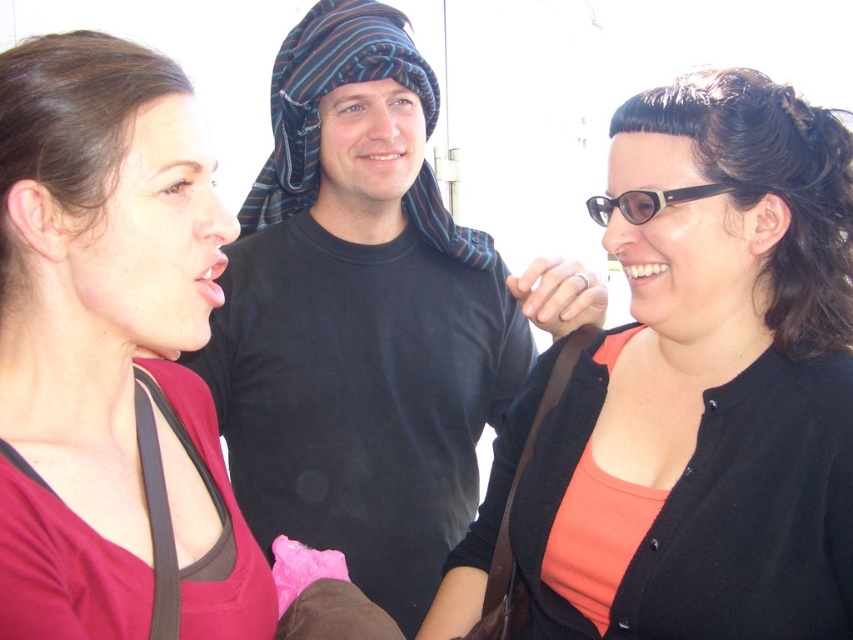
You are standing 5 feet away from the camera. Can you reach the point at coordinates point (94, 250) without moving closer?

The point at coordinates point (94, 250) is 3.53 feet from the camera. Since you are standing 5 feet away from the camera, you are farther away than the point. Therefore, you cannot reach it without moving closer.

Based on the scene description, can you determine if the matte red shirt at left is positioned in front of or behind the black cotton shirt at center?

The matte red shirt at left is behind the black cotton shirt at center.